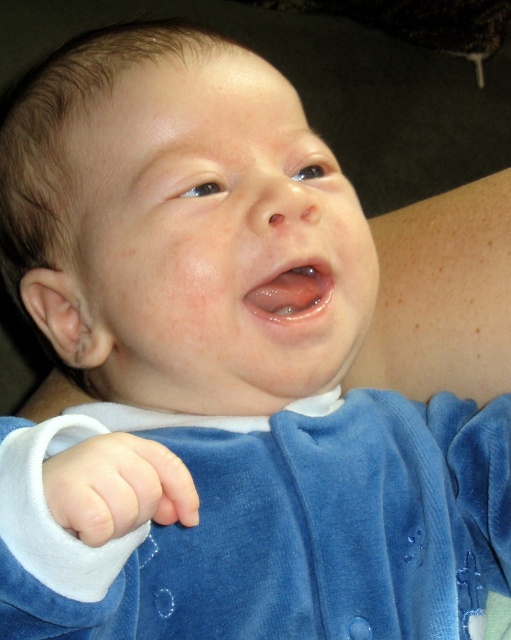
Question: Which point is closer to the camera taking this photo?

Choices:
 (A) (76, 557)
 (B) (185, 506)

Answer: (A)

Question: Does velvet blue sleeve at lower left come behind white soft fabric hand at lower left?

Choices:
 (A) yes
 (B) no

Answer: (B)

Question: Based on their relative distances, which object is farther from the white soft hand at center?

Choices:
 (A) velvet blue sleeve at lower left
 (B) white soft fabric hand at lower left

Answer: (B)

Question: Which object is closer to the camera taking this photo?

Choices:
 (A) white soft hand at center
 (B) white soft fabric hand at lower left

Answer: (A)

Question: Where is white soft hand at center located in relation to white soft fabric hand at lower left in the image?

Choices:
 (A) above
 (B) below

Answer: (A)

Question: Does velvet blue sleeve at lower left have a lesser width compared to white soft hand at center?

Choices:
 (A) yes
 (B) no

Answer: (B)